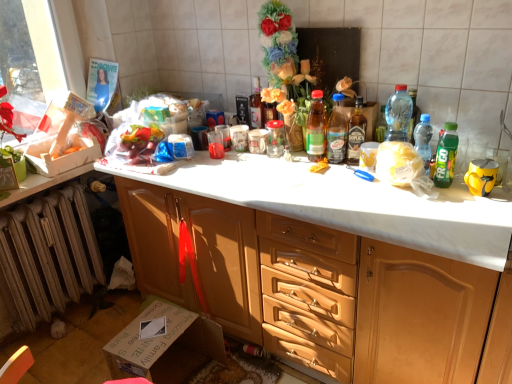
This screenshot has height=384, width=512. In order to click on free space in front of translucent plastic bottle at center, the 6th bottle when ordered from right to left in this screenshot , I will do `click(317, 169)`.